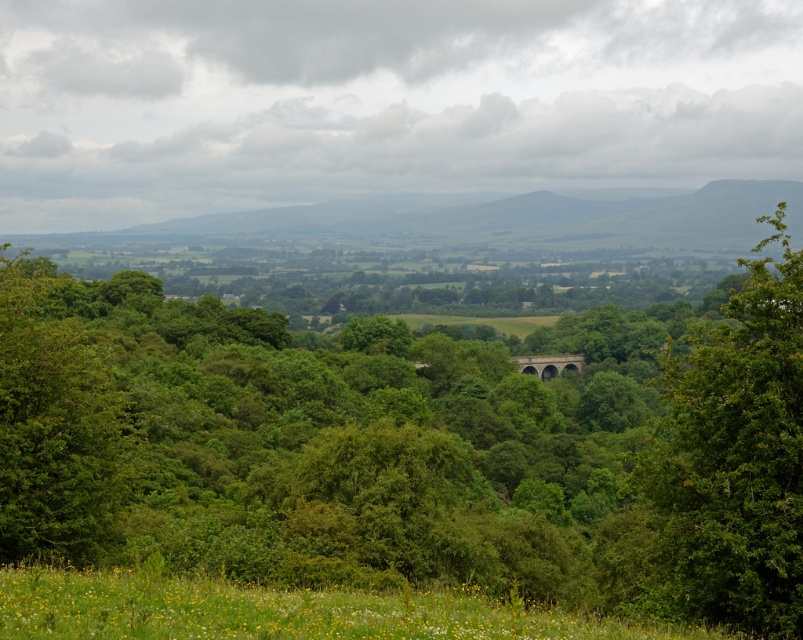
Question: Which object appears farthest from the camera in this image?

Choices:
 (A) green leafy tree at right
 (B) green stone arch bridge at center

Answer: (B)

Question: Which object appears farthest from the camera in this image?

Choices:
 (A) green leafy tree at right
 (B) green stone arch bridge at center

Answer: (B)

Question: Can you confirm if green leafy tree at center is positioned to the left of green leafy tree at right?

Choices:
 (A) no
 (B) yes

Answer: (B)

Question: Can you confirm if green leafy tree at right is positioned to the left of green stone arch bridge at center?

Choices:
 (A) no
 (B) yes

Answer: (B)

Question: Can you confirm if green leafy tree at right is positioned to the left of green stone arch bridge at center?

Choices:
 (A) no
 (B) yes

Answer: (B)

Question: Which object is farther from the camera taking this photo?

Choices:
 (A) green stone arch bridge at center
 (B) green leafy tree at right

Answer: (A)